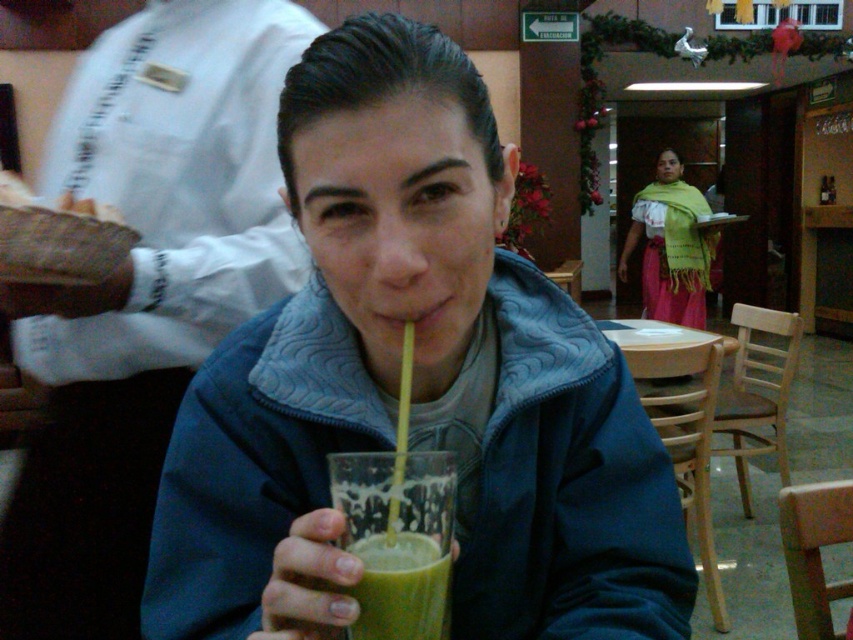
You are sitting at the table in the image and want to place your phone on the table. There are two points marked on the table surface at coordinates point (405, 456) and point (402, 586). Which point is closer to the back edge of the table?

Point (405, 456) is behind point (402, 586), so it is closer to the back edge of the table.

You are a barista trying to prepare a drink for a customer. The customer wants a drink that is as wide as the green smoothie at center. Do you think the matte glass cup at center can fit the drink?

The matte glass cup at center might be wider than green smoothie at center, so it can potentially accommodate the drink with similar width requirements.